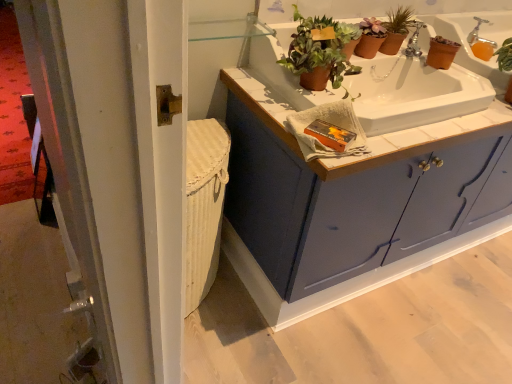
Question: Is white tile countertop at upper center facing away from silver metallic faucet at upper right?

Choices:
 (A) yes
 (B) no

Answer: (B)

Question: Does white tile countertop at upper center have a larger size compared to silver metallic faucet at upper right?

Choices:
 (A) no
 (B) yes

Answer: (B)

Question: Is there a large distance between white tile countertop at upper center and silver metallic faucet at upper right?

Choices:
 (A) no
 (B) yes

Answer: (A)

Question: Does white tile countertop at upper center appear on the right side of silver metallic faucet at upper right?

Choices:
 (A) yes
 (B) no

Answer: (B)

Question: From a real-world perspective, is white tile countertop at upper center positioned over silver metallic faucet at upper right based on gravity?

Choices:
 (A) yes
 (B) no

Answer: (B)

Question: Is terracotta clay pot at upper center, the second houseplant when ordered from front to back, in front of or behind matte blue cabinet at center in the image?

Choices:
 (A) behind
 (B) front

Answer: (A)

Question: From a real-world perspective, is terracotta clay pot at upper center, which is the 1th houseplant in right-to-left order, above or below matte blue cabinet at center?

Choices:
 (A) below
 (B) above

Answer: (B)

Question: Considering the positions of point (385, 26) and point (375, 160), is point (385, 26) closer or farther from the camera than point (375, 160)?

Choices:
 (A) farther
 (B) closer

Answer: (A)

Question: In terms of size, does terracotta clay pot at upper center, which is the first houseplant in back-to-front order, appear bigger or smaller than matte blue cabinet at center?

Choices:
 (A) small
 (B) big

Answer: (A)

Question: Considering their positions, is silver metallic faucet at upper right located in front of or behind white tile countertop at upper center?

Choices:
 (A) front
 (B) behind

Answer: (B)

Question: Would you say silver metallic faucet at upper right is inside or outside white tile countertop at upper center?

Choices:
 (A) outside
 (B) inside

Answer: (A)

Question: Does point (472, 29) appear closer or farther from the camera than point (265, 120)?

Choices:
 (A) closer
 (B) farther

Answer: (B)

Question: Is silver metallic faucet at upper right wider or thinner than white tile countertop at upper center?

Choices:
 (A) thin
 (B) wide

Answer: (A)

Question: In terms of height, does white tile countertop at upper center look taller or shorter compared to terracotta clay pot at upper center, which appears as the second houseplant when viewed from the right?

Choices:
 (A) short
 (B) tall

Answer: (B)

Question: Is white tile countertop at upper center bigger or smaller than terracotta clay pot at upper center, acting as the 2th houseplant starting from the back?

Choices:
 (A) big
 (B) small

Answer: (A)